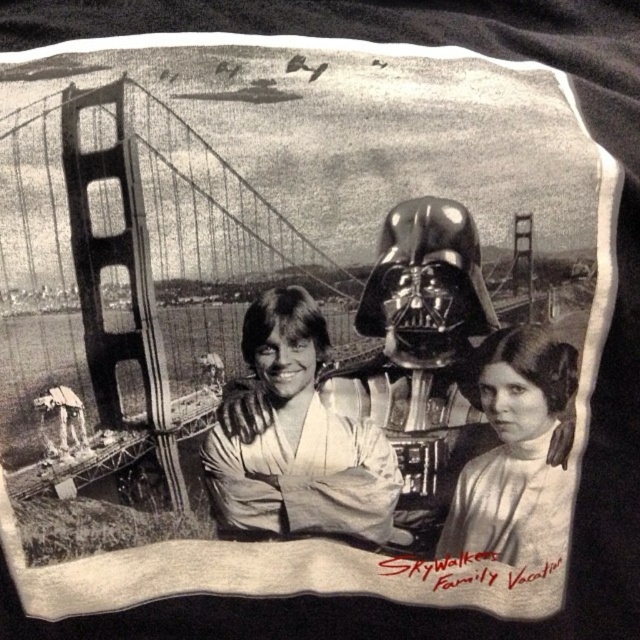
Question: Can you confirm if smooth white shirt at center is positioned above smooth skin girl at lower right?

Choices:
 (A) yes
 (B) no

Answer: (A)

Question: Among these objects, which one is farthest from the camera?

Choices:
 (A) smooth white shirt at center
 (B) smooth skin girl at lower right

Answer: (B)

Question: Among these objects, which one is nearest to the camera?

Choices:
 (A) smooth white shirt at center
 (B) smooth skin girl at lower right

Answer: (A)

Question: Considering the relative positions of smooth white shirt at center and smooth skin girl at lower right in the image provided, where is smooth white shirt at center located with respect to smooth skin girl at lower right?

Choices:
 (A) right
 (B) left

Answer: (B)

Question: Can you confirm if smooth white shirt at center is positioned to the right of smooth skin girl at lower right?

Choices:
 (A) yes
 (B) no

Answer: (B)

Question: Which point is farther to the camera?

Choices:
 (A) smooth white shirt at center
 (B) smooth skin girl at lower right

Answer: (B)